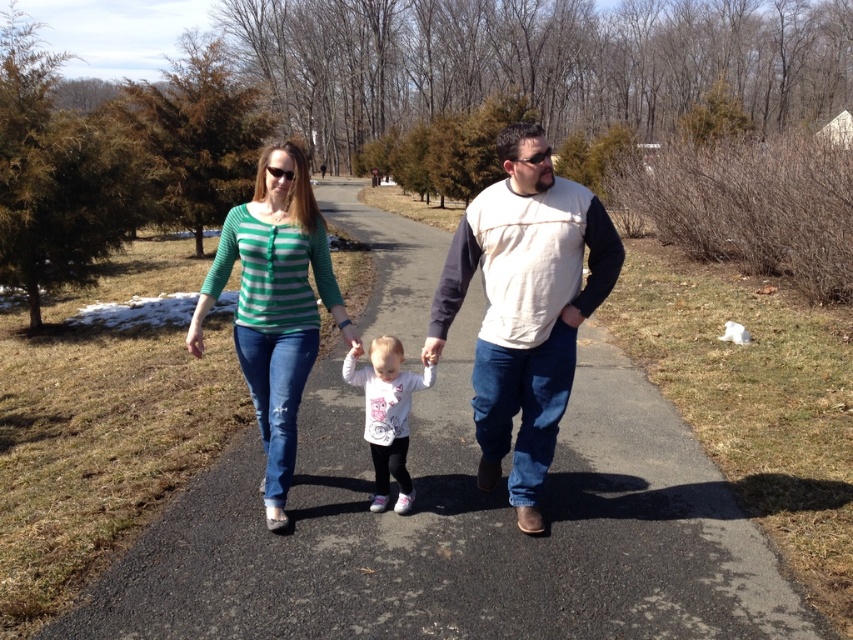
Question: Can you confirm if green striped shirt at center is positioned to the right of white matte shirt at center?

Choices:
 (A) yes
 (B) no

Answer: (B)

Question: Which point is closer to the camera?

Choices:
 (A) matte green striped shirt at center
 (B) asphalt at center
 (C) light beige sweater at center

Answer: (B)

Question: Is matte green striped shirt at center below white matte shirt at center?

Choices:
 (A) yes
 (B) no

Answer: (B)

Question: Estimate the real-world distances between objects in this image. Which object is farther from the asphalt at center?

Choices:
 (A) white matte shirt at center
 (B) light beige sweater at center
 (C) matte green striped shirt at center

Answer: (C)

Question: Which of the following is the closest to the observer?

Choices:
 (A) matte green striped shirt at center
 (B) light beige sweater at center
 (C) asphalt at center

Answer: (C)

Question: Is asphalt at center positioned in front of white matte shirt at center?

Choices:
 (A) yes
 (B) no

Answer: (A)